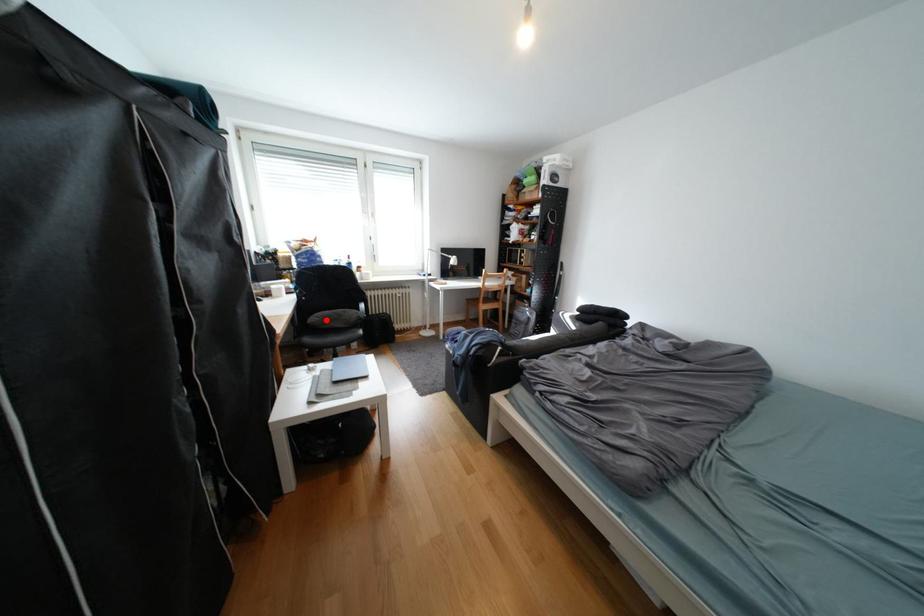
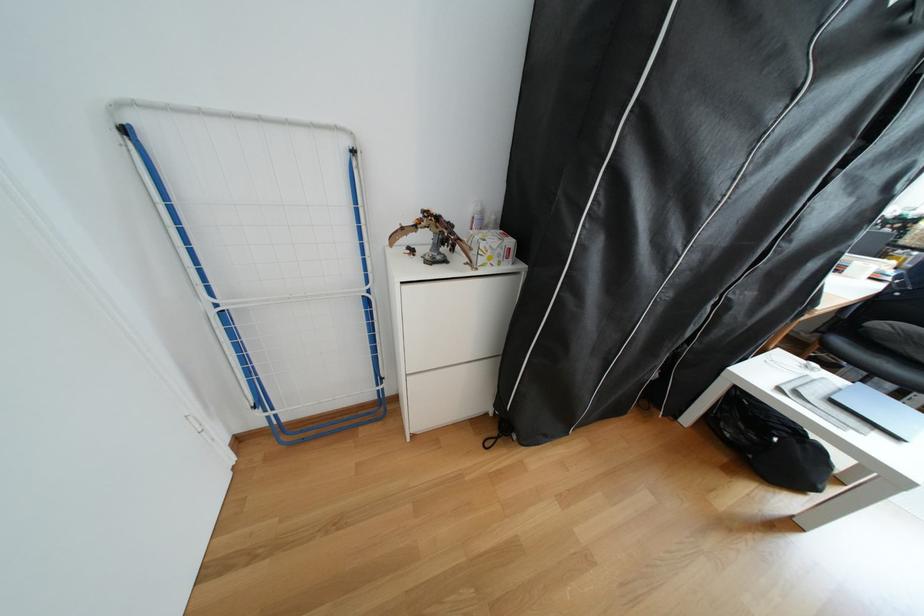
Question: I am providing you with two images of the same scene from different viewpoints. In image1, a red point is highlighted. Considering the same 3D point in image2, which of the following is correct?

Choices:
 (A) It is closer
 (B) It is farther

Answer: (B)